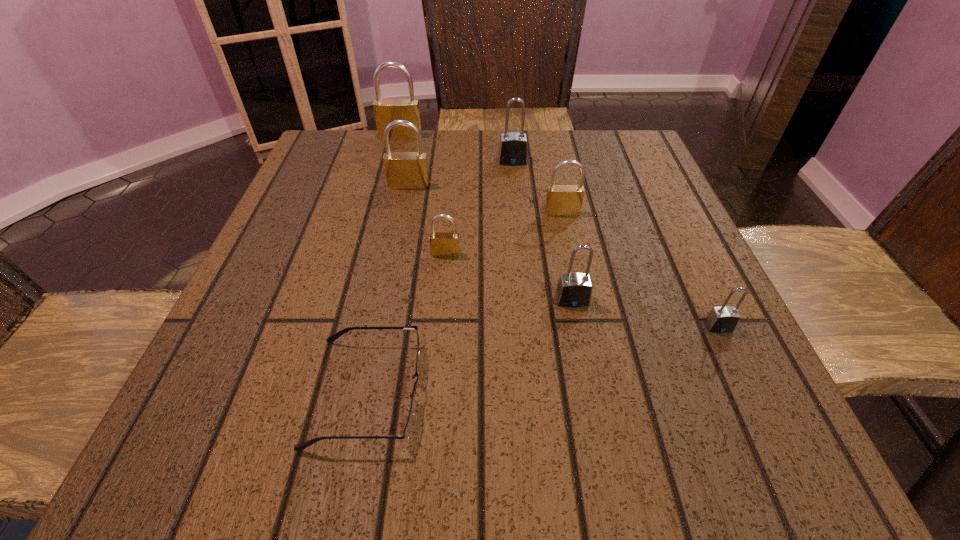
You are a GUI agent. You are given a task and a screenshot of the screen. Output one action in this format:
    pyautogui.click(x=<x>, y=<y>)
    Task: Click on the closest gray padlock to the nearest padlock
    This screenshot has height=540, width=960.
    Given the screenshot: What is the action you would take?
    pyautogui.click(x=574, y=290)

Identify which gray padlock is located as the third nearest to the tallest padlock. Please provide its 2D coordinates. Your answer should be formatted as a tuple, i.e. [(x, y)], where the tuple contains the x and y coordinates of a point satisfying the conditions above.

[(723, 319)]